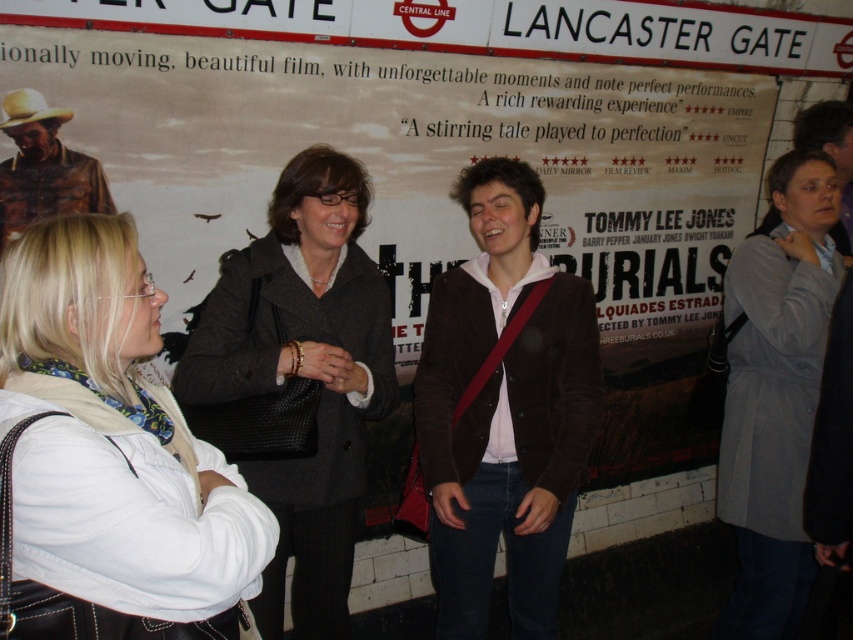
Question: Which object is farther from the camera taking this photo?

Choices:
 (A) white leather jacket at lower left
 (B) dark gray wool coat at center

Answer: (B)

Question: Can you confirm if white leather jacket at lower left is wider than rustic leather jacket at left?

Choices:
 (A) no
 (B) yes

Answer: (B)

Question: Is dark gray wool coat at center wider than light brown felt cowboy hat at upper left?

Choices:
 (A) no
 (B) yes

Answer: (B)

Question: Is rustic leather jacket at left positioned in front of light brown felt cowboy hat at upper left?

Choices:
 (A) yes
 (B) no

Answer: (A)

Question: Which is nearer to the light brown felt cowboy hat at upper left?

Choices:
 (A) brown corduroy jacket at center
 (B) gray wool coat at right
 (C) rustic leather jacket at left

Answer: (C)

Question: Which object appears closest to the camera in this image?

Choices:
 (A) dark gray wool coat at center
 (B) gray fabric coat at right
 (C) gray wool coat at right

Answer: (A)